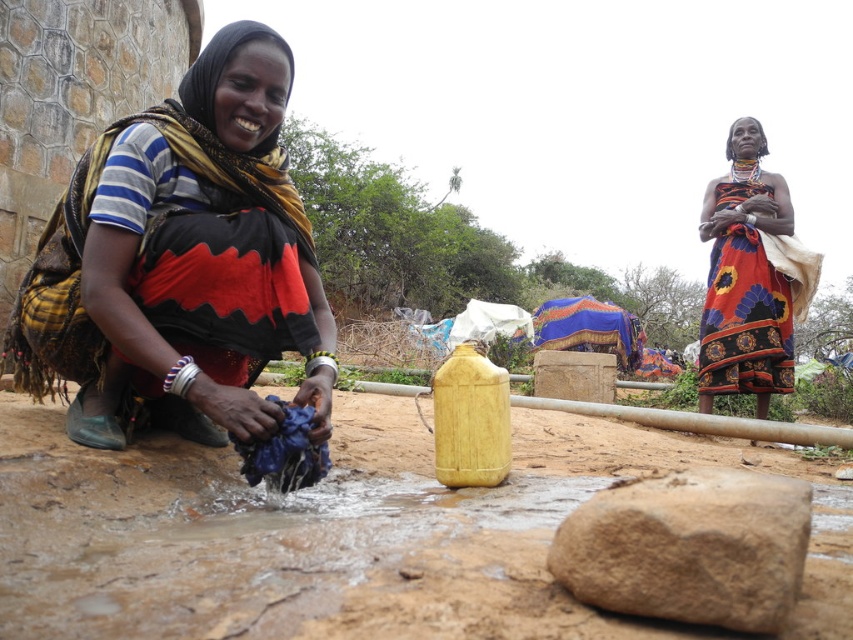
Question: Which object is closer to the camera taking this photo?

Choices:
 (A) brown rough rock at lower center
 (B) matte black scarf at lower left

Answer: (A)

Question: Is matte black scarf at lower left smaller than floral fabric dress at center?

Choices:
 (A) yes
 (B) no

Answer: (A)

Question: Which of the following is the farthest from the observer?

Choices:
 (A) (751, 346)
 (B) (222, 353)

Answer: (A)

Question: Considering the relative positions of matte black scarf at lower left and floral fabric dress at center in the image provided, where is matte black scarf at lower left located with respect to floral fabric dress at center?

Choices:
 (A) above
 (B) below

Answer: (B)

Question: Which point appears farthest from the camera in this image?

Choices:
 (A) (608, 588)
 (B) (703, 342)

Answer: (B)

Question: Does brown rough rock at lower center lie in front of floral fabric dress at center?

Choices:
 (A) yes
 (B) no

Answer: (A)